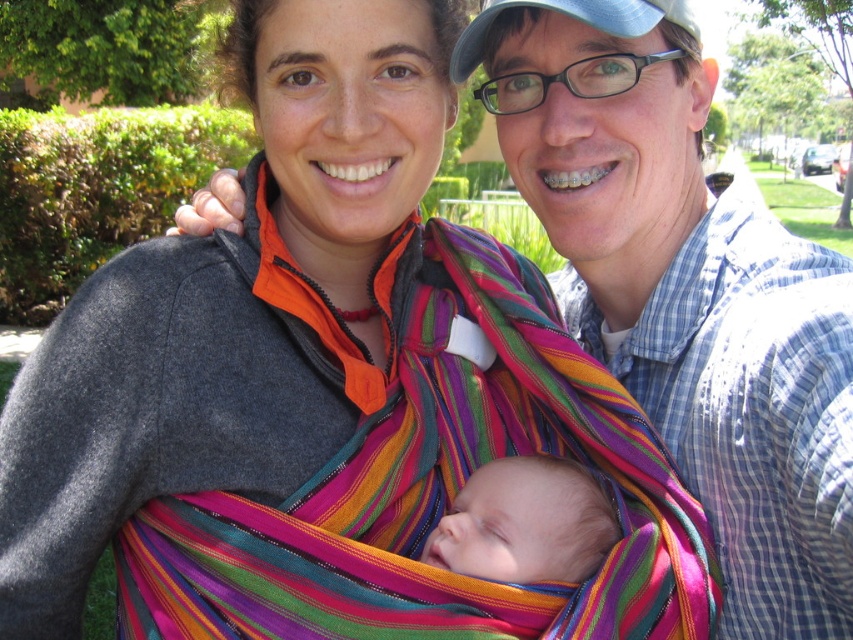
Question: Does soft pink fabric at center appear under blue fabric baseball cap at upper center?

Choices:
 (A) no
 (B) yes

Answer: (B)

Question: Can you confirm if soft pink fabric at center is positioned to the left of blue fabric baseball cap at upper center?

Choices:
 (A) no
 (B) yes

Answer: (B)

Question: Does soft pink fabric at center appear on the left side of blue fabric baseball cap at upper center?

Choices:
 (A) yes
 (B) no

Answer: (A)

Question: Which object is farther from the camera taking this photo?

Choices:
 (A) blue fabric baseball cap at upper center
 (B) soft pink fabric at center

Answer: (A)

Question: Which object appears closest to the camera in this image?

Choices:
 (A) soft pink fabric at center
 (B) blue fabric baseball cap at upper center

Answer: (A)

Question: Which point is closer to the camera taking this photo?

Choices:
 (A) (485, 20)
 (B) (614, 538)

Answer: (B)